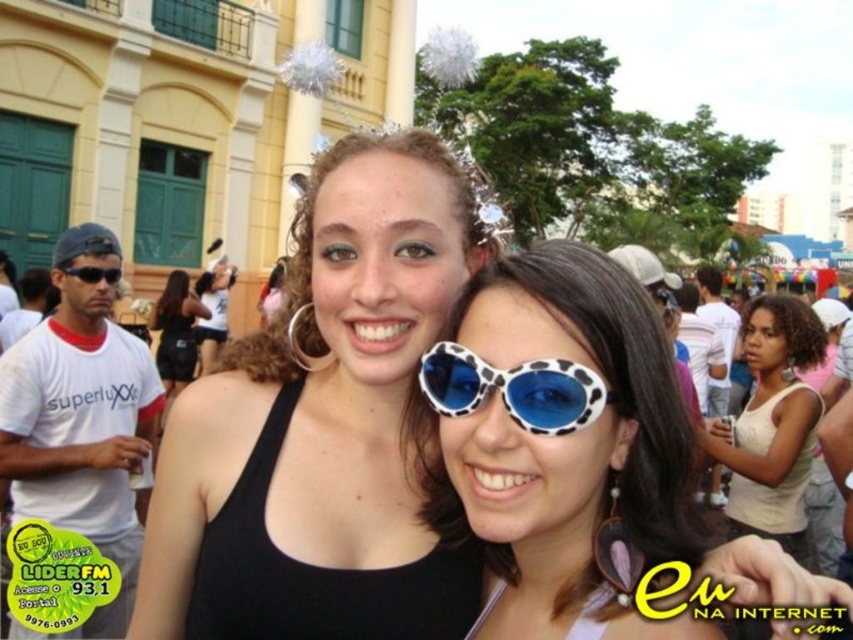
You are a photographer at the event and need to capture a clear shot of both the white leopard print sunglasses at center and the matte black tank top at center. Which object should you focus on first to ensure both are in focus?

The white leopard print sunglasses at center is positioned under the matte black tank top at center, so you should focus on the matte black tank top at center first since it is closer to the camera.

In the scene shown: You are a photographer at the event and need to capture a photo where both the white leopard print sunglasses at center and the matte black tank top at center are clearly visible. Given their height difference, which object should you focus on first to ensure both are in frame?

The white leopard print sunglasses at center is much taller than the matte black tank top at center. To ensure both are in frame, focus on the white leopard print sunglasses at center first, then adjust the camera angle to include the matte black tank top at center.